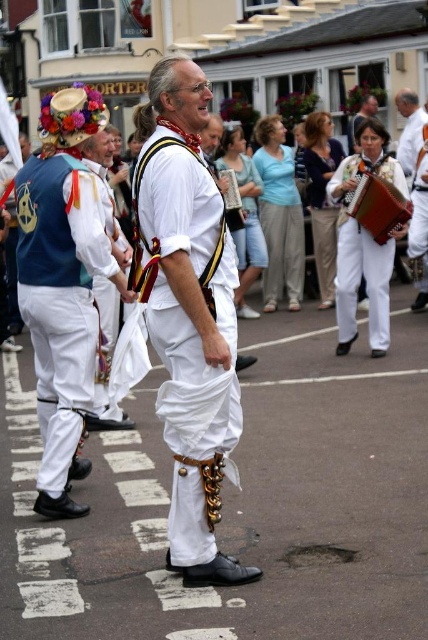
Can you confirm if white matte pants at center is positioned below white cotton accordion at center?

Correct, white matte pants at center is located below white cotton accordion at center.

Is white matte pants at center positioned at the back of white cotton accordion at center?

That is False.

Find the location of a particular element. The image size is (428, 640). white matte pants at center is located at coordinates (189, 314).

Is matte blue vest at center smaller than white cotton accordion at center?

No.

Is matte blue vest at center shorter than white cotton accordion at center?

Indeed, matte blue vest at center has a lesser height compared to white cotton accordion at center.

At what (x,y) coordinates should I click in order to perform the action: click on matte blue vest at center. Please return your answer as a coordinate pair (x, y). Looking at the image, I should click on (62, 284).

Which of these two, white matte pants at center or matte blue vest at center, stands taller?

Standing taller between the two is white matte pants at center.

How distant is white matte pants at center from matte blue vest at center?

2.79 meters

At what (x,y) coordinates should I click in order to perform the action: click on white matte pants at center. Please return your answer as a coordinate pair (x, y). This screenshot has height=640, width=428. Looking at the image, I should click on (189, 314).